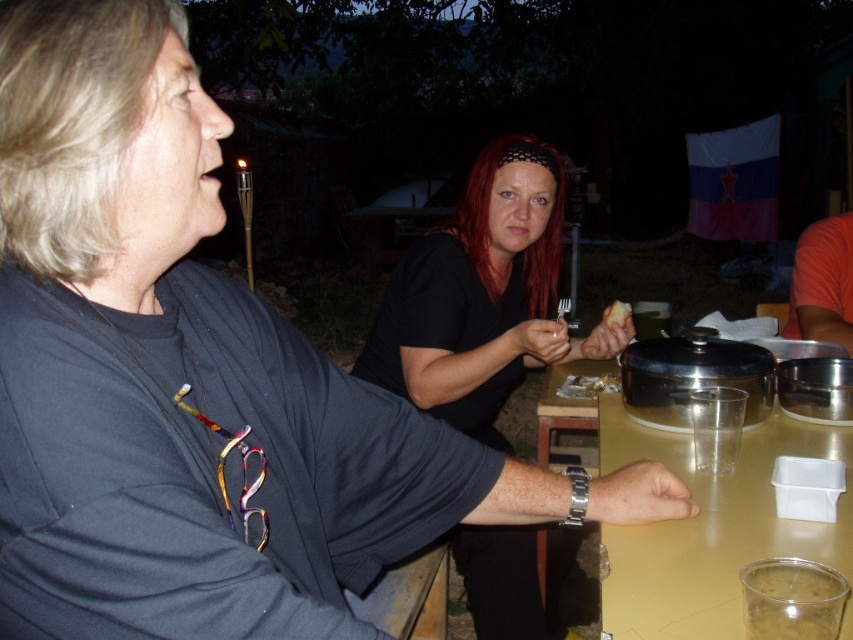
You are standing in the scene and want to place a 12 inch long object on the translucent plastic table at center. Is there enough space on the table for it?

The translucent plastic table at center is 34.48 inches from viewer. Since the object is 12 inches long, and the table is 34.48 inches away, there is sufficient space to place the object on the table.

You are standing at the edge of the gathering area and want to sit down at the translucent plastic table at center. Is the black matte shirt at center currently blocking your path to the table?

The black matte shirt at center is positioned over the translucent plastic table at center, meaning the person wearing it is sitting at the table. This would block your path to sitting there unless you move them first.